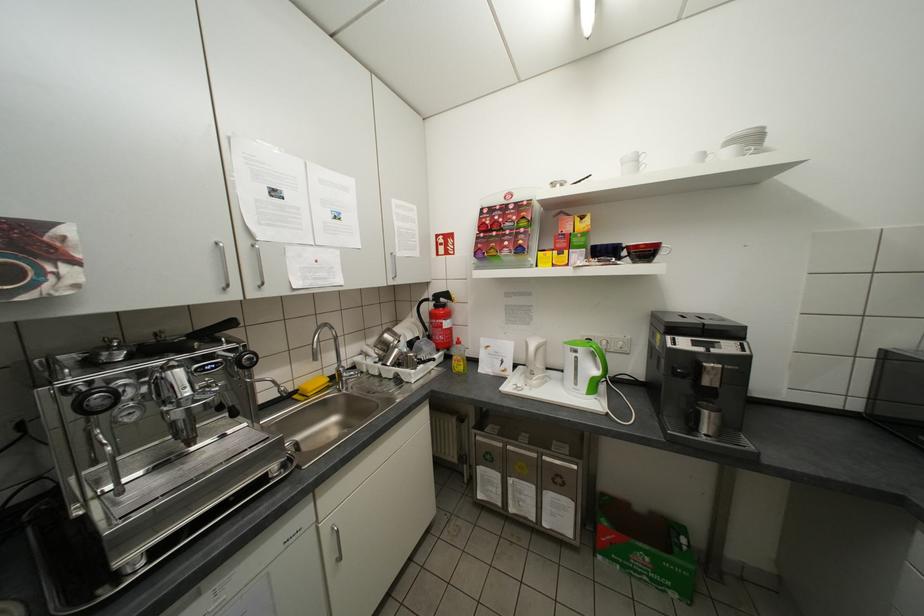
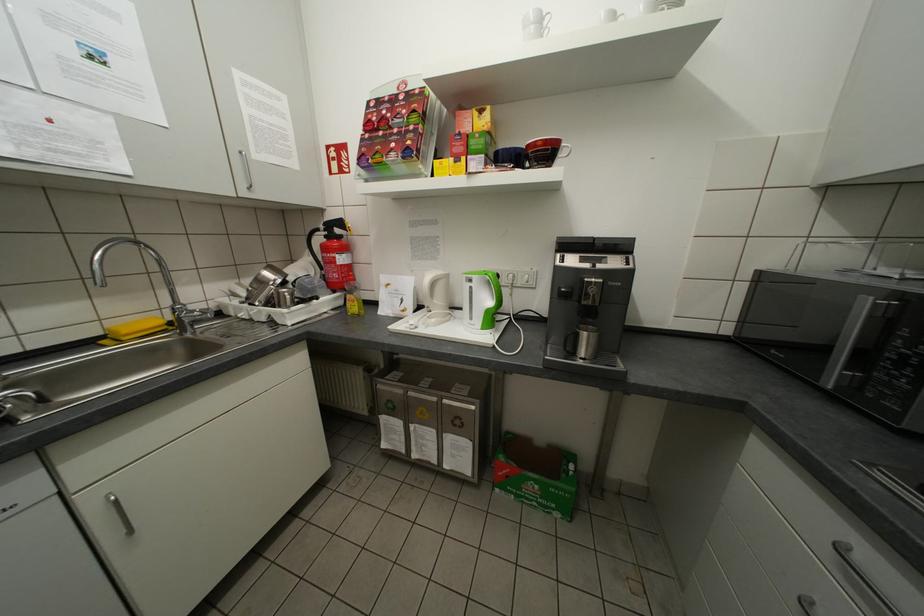
The point at (714, 436) is marked in the first image. Where is the corresponding point in the second image?

(590, 359)